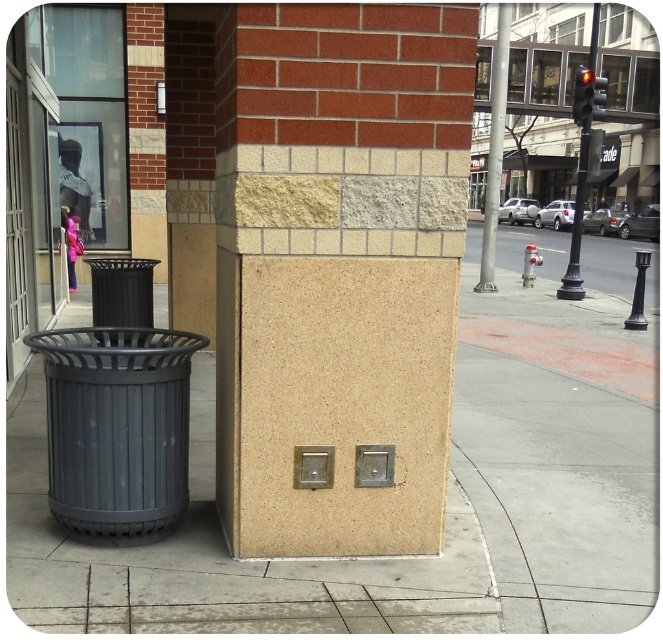
You are standing at the point marked as point (337, 272) in the city sidewalk scene. What object are you touching?

The point (337, 272) is on beige textured pillar at center, so you are touching the beige textured pillar at center.

You are standing at the point marked by the coordinates point (337,272). What object is directly in front of you?

The beige textured pillar at center is directly in front of you at the coordinates point (337,272).